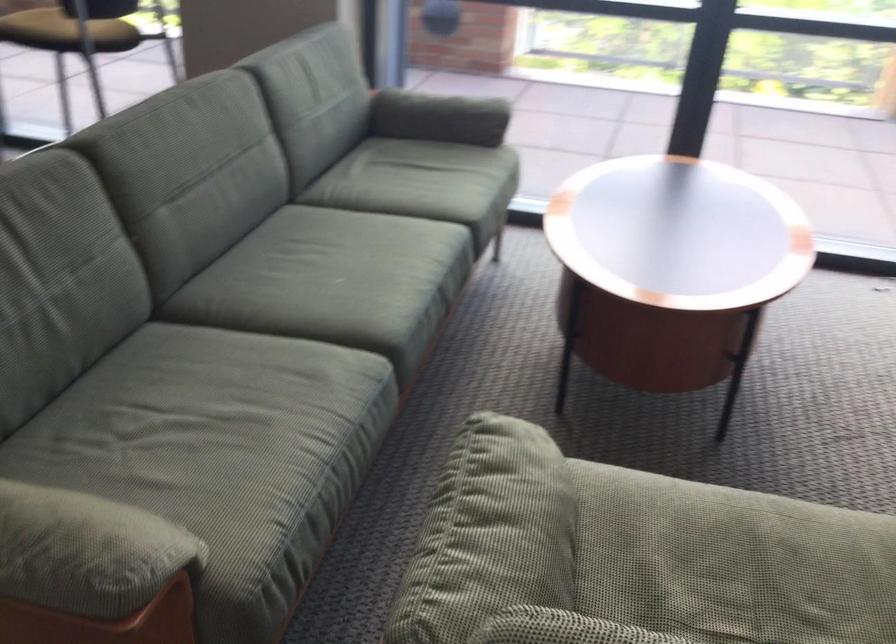
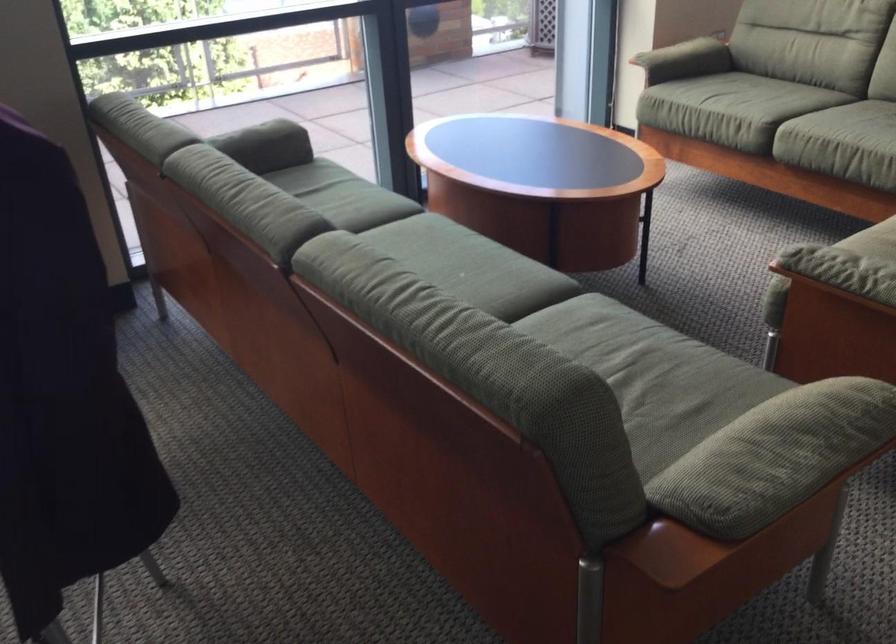
The point at (347, 267) is marked in the first image. Where is the corresponding point in the second image?

(442, 267)